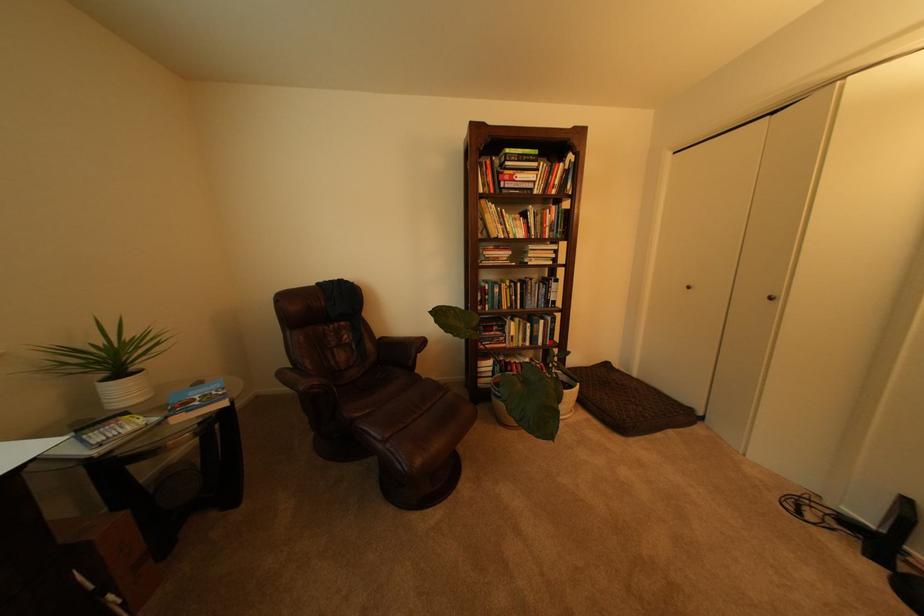
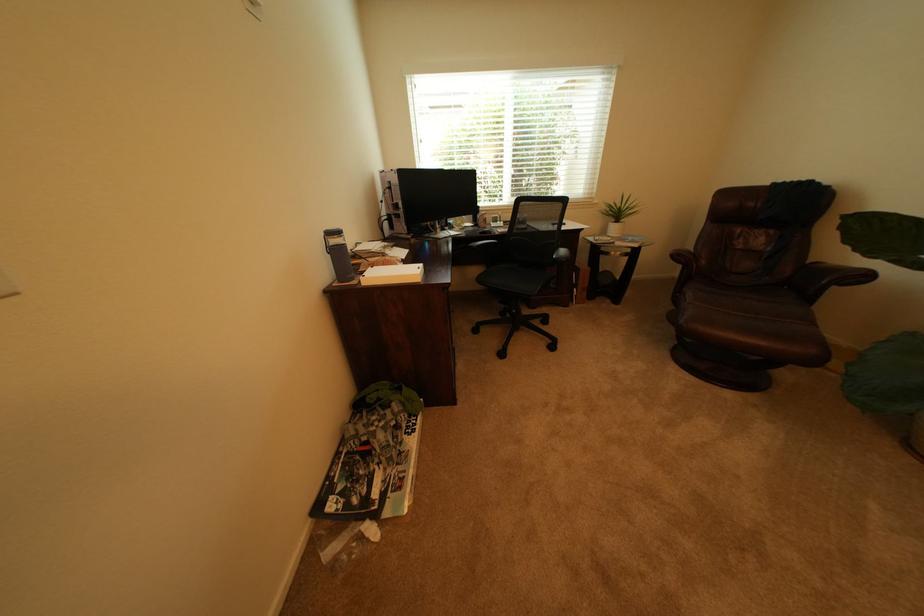
In the second image, find the point that corresponds to pixel 391 440 in the first image.

(699, 302)